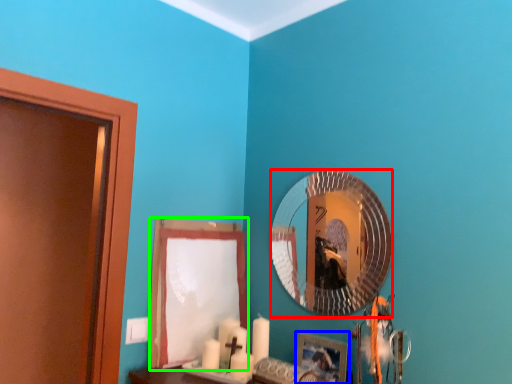
Question: Estimate the real-world distances between objects in this image. Which object is farther from mirror (highlighted by a red box), picture frame (highlighted by a blue box) or curtain (highlighted by a green box)?

Choices:
 (A) picture frame
 (B) curtain

Answer: (B)